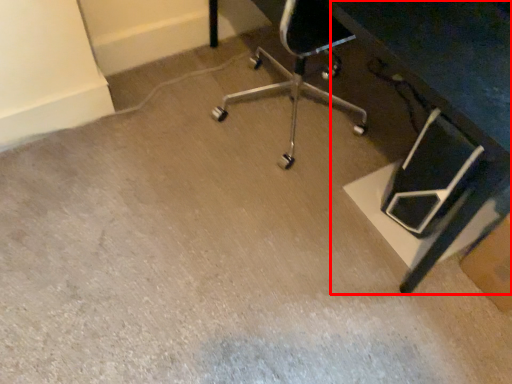
Question: From the image's perspective, what is the correct spatial relationship of table (annotated by the red box) in relation to cardboard box?

Choices:
 (A) above
 (B) below

Answer: (A)